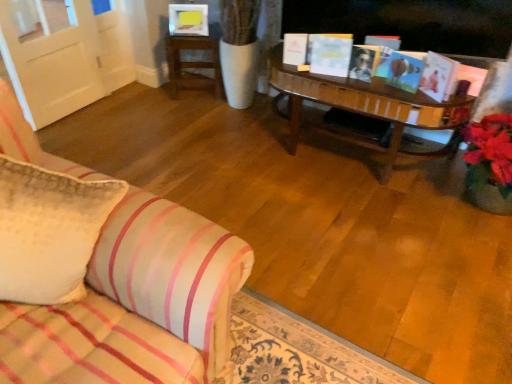
Identify the location of free location in front of wooden table at upper center. (190, 114).